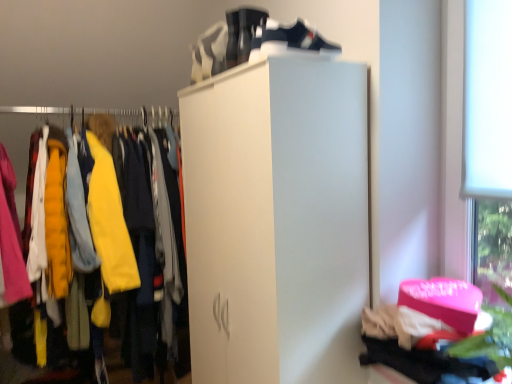
Question: Is white matte running shoe at upper center facing away from white matte closet at left?

Choices:
 (A) no
 (B) yes

Answer: (A)

Question: From a real-world perspective, is white matte running shoe at upper center on white matte closet at left?

Choices:
 (A) no
 (B) yes

Answer: (B)

Question: Considering the relative positions of white matte running shoe at upper center and white matte closet at left in the image provided, is white matte running shoe at upper center to the right of white matte closet at left from the viewer's perspective?

Choices:
 (A) yes
 (B) no

Answer: (A)

Question: Does white matte running shoe at upper center have a larger size compared to white matte closet at left?

Choices:
 (A) yes
 (B) no

Answer: (B)

Question: Considering the relative sizes of white matte running shoe at upper center and white matte closet at left in the image provided, is white matte running shoe at upper center shorter than white matte closet at left?

Choices:
 (A) yes
 (B) no

Answer: (A)

Question: Is white matte running shoe at upper center oriented towards white matte closet at left?

Choices:
 (A) no
 (B) yes

Answer: (A)

Question: Can you confirm if white matte running shoe at upper center is positioned to the right of white leather shoe at upper center?

Choices:
 (A) no
 (B) yes

Answer: (A)

Question: Does white matte running shoe at upper center have a lesser width compared to white leather shoe at upper center?

Choices:
 (A) yes
 (B) no

Answer: (A)

Question: Can you confirm if white matte running shoe at upper center is positioned to the left of white leather shoe at upper center?

Choices:
 (A) no
 (B) yes

Answer: (B)

Question: Is white leather shoe at upper center completely or partially inside white matte running shoe at upper center?

Choices:
 (A) no
 (B) yes

Answer: (A)

Question: Is the depth of white matte running shoe at upper center less than that of white leather shoe at upper center?

Choices:
 (A) no
 (B) yes

Answer: (A)

Question: Considering the relative sizes of white matte running shoe at upper center and white leather shoe at upper center in the image provided, is white matte running shoe at upper center taller than white leather shoe at upper center?

Choices:
 (A) yes
 (B) no

Answer: (A)

Question: Would you consider white matte closet at left to be distant from white matte running shoe at upper center?

Choices:
 (A) yes
 (B) no

Answer: (B)